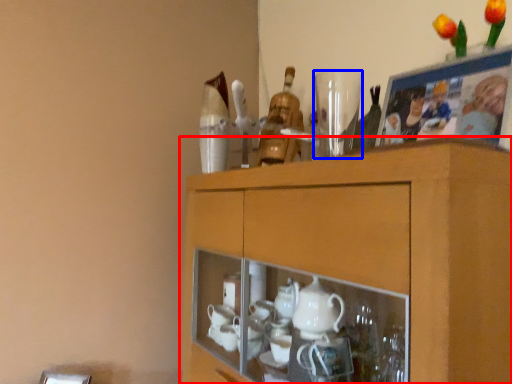
Question: Among these objects, which one is nearest to the camera, cabinetry (highlighted by a red box) or tableware (highlighted by a blue box)?

Choices:
 (A) cabinetry
 (B) tableware

Answer: (A)